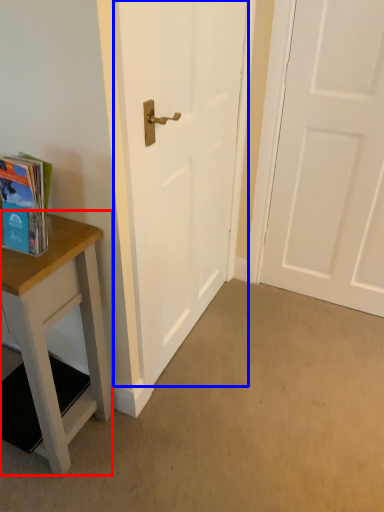
Question: Which object is closer to the camera taking this photo, table (highlighted by a red box) or door (highlighted by a blue box)?

Choices:
 (A) table
 (B) door

Answer: (A)